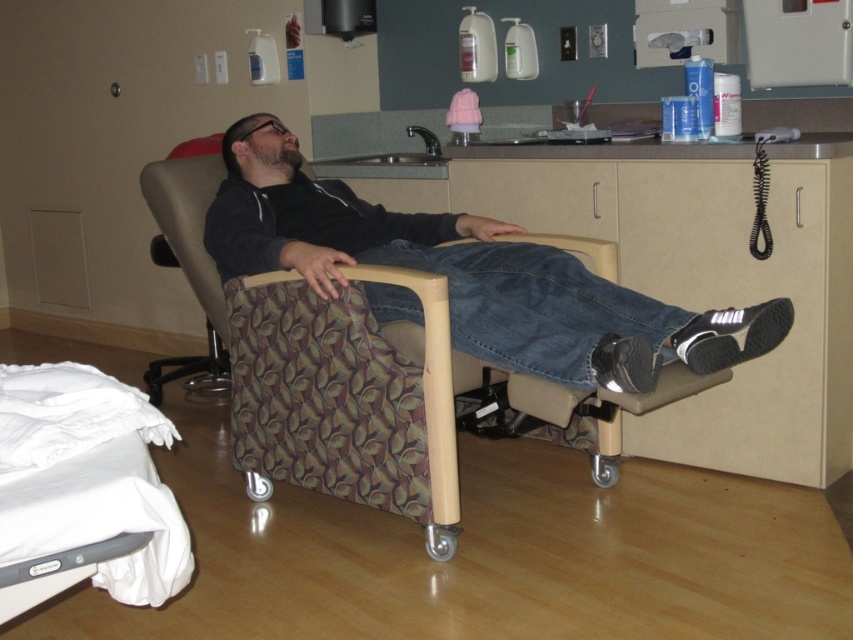
You are a nurse who needs to retrieve a medical kit from the matte plastic drawer at center while attending to a patient in the white fabric hospital bed at lower left. Considering the distance between them, can you reach the drawer without leaving the patient within your line of sight?

The white fabric hospital bed at lower left and matte plastic drawer at center are 5.75 feet apart from each other. Since the distance is relatively short, you can likely reach the drawer while keeping the patient in your line of sight.

Based on the photo, A nurse needs to place a medical chart on a surface within reach of the man in the chair. The nurse has two options for placement. The first option is at point A located at point (129, 566). The second option is at point B, which is 1.29 meters away from point A. Which point is farther from the man?

The second option at point B is farther from the man because it is 1.29 meters away from point A, which is the closer point.

You are a physical therapist assessing the setup of a rehabilitation room. You need to determine if the white fabric hospital bed at lower left can be moved under a low ceiling that is only 2 meters high. The patterned fabric swivel chair at center is currently in the room. Can the bed fit under the ceiling without being disassembled?

The white fabric hospital bed at lower left is not as tall as the patterned fabric swivel chair at center. Since the chair is in the room and the bed is shorter, the bed can fit under the 2 meter ceiling without disassembly.